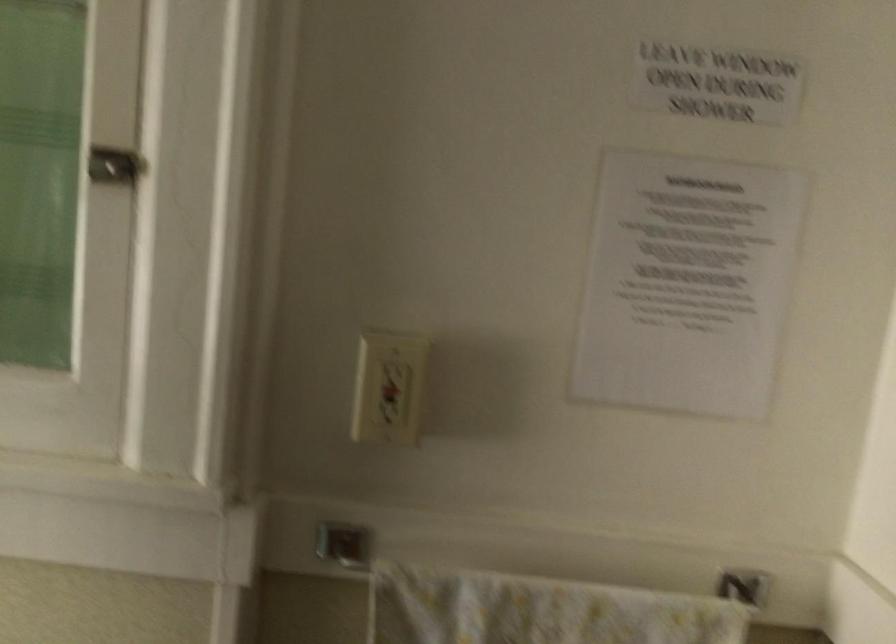
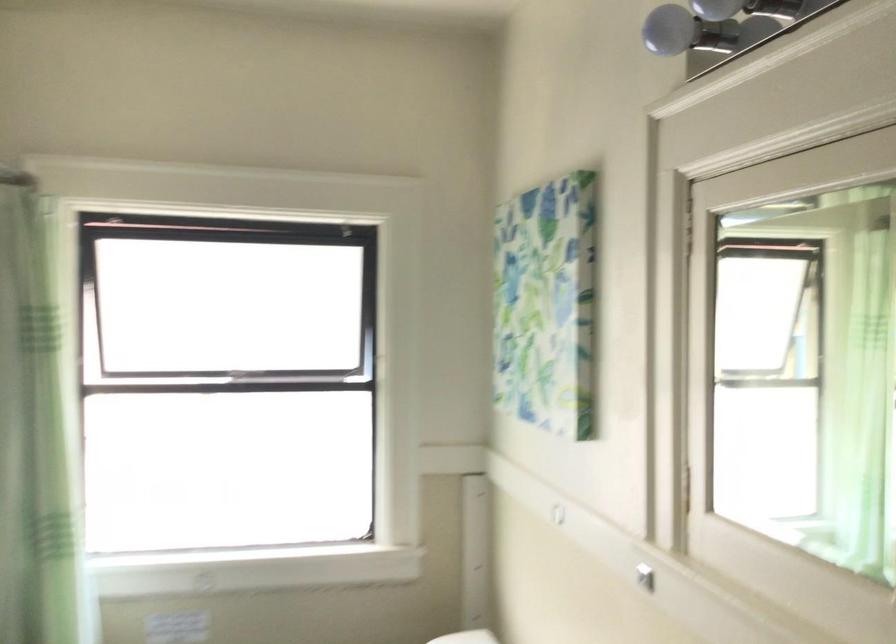
Question: The first image is from the beginning of the video and the second image is from the end. How did the camera likely rotate when shooting the video?

Choices:
 (A) Left
 (B) Right
 (C) Up
 (D) Down

Answer: (A)